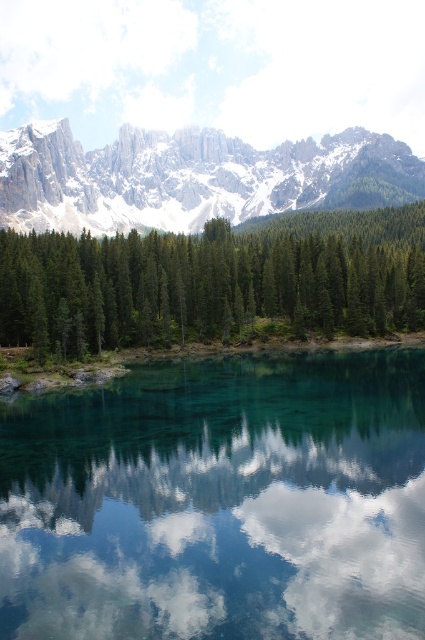
You are standing at the lakeside and notice the transparent glass water at center and the white fluffy cloud at center. Which object is closer to you, the observer?

The transparent glass water at center is closer to you because it is much taller than the white fluffy cloud at center, indicating it occupies a lower position in the visual plane.

You are standing at the point with coordinates point (331, 561) and want to walk to the point with coordinates point (3, 157). Which direction should you move in to reach your destination?

You should move towards the lower left direction to reach point (3, 157) from point (331, 561).

You are standing at the lakeside and notice the transparent glass water at center and the white fluffy cloud at center. Which one do you think is wider in the image?

The transparent glass water at center might be wider than white fluffy cloud at center according to the description.